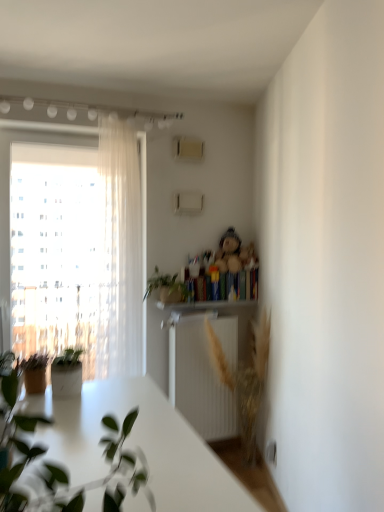
In order to face sheer white curtain at left, should I rotate leftwards or rightwards?

It's best to rotate left around 9.683 degrees.

Describe the element at coordinates (122, 247) in the screenshot. This screenshot has width=384, height=512. I see `sheer white curtain at left` at that location.

What do you see at coordinates (66, 470) in the screenshot? I see `green matte plant at left, marked as the 2th houseplant in a back-to-front arrangement` at bounding box center [66, 470].

How much space does green matte plant at left, positioned as the 1th houseplant in front-to-back order, occupy vertically?

The height of green matte plant at left, positioned as the 1th houseplant in front-to-back order, is 19.25 inches.

What do you see at coordinates (225, 285) in the screenshot? I see `hardcover book at center` at bounding box center [225, 285].

I want to click on green matte plant at center, which is counted as the first houseplant, starting from the back, so click(x=166, y=287).

This screenshot has height=512, width=384. Identify the location of window sill directly beneath the transparent glass window at left (from a real-world perspective). (206, 305).

Is transparent glass window at left oriented away from wooden shelf at upper center?

No, wooden shelf at upper center is not at the back of transparent glass window at left.

Which object is further away from the camera, transparent glass window at left or wooden shelf at upper center?

wooden shelf at upper center is more distant.

Considering the relative sizes of sheer white curtain at left and hardcover book at center in the image provided, is sheer white curtain at left taller than hardcover book at center?

Indeed, sheer white curtain at left has a greater height compared to hardcover book at center.

Considering their positions, is sheer white curtain at left located in front of or behind hardcover book at center?

sheer white curtain at left is positioned closer to the viewer than hardcover book at center.

Is hardcover book at center surrounded by sheer white curtain at left?

No, hardcover book at center is located outside of sheer white curtain at left.

From the image's perspective, which object appears higher, sheer white curtain at left or hardcover book at center?

From the image's view, sheer white curtain at left is above.

Considering the positions of point (5, 379) and point (204, 298), is point (5, 379) closer or farther from the camera than point (204, 298)?

Point (5, 379).

Looking at this image, is green matte plant at left, positioned as the 1th houseplant in front-to-back order, oriented towards hardcover book at center?

No, green matte plant at left, positioned as the 1th houseplant in front-to-back order, is not facing towards hardcover book at center.

Does green matte plant at left, marked as the 2th houseplant in a back-to-front arrangement, have a smaller size compared to hardcover book at center?

Incorrect, green matte plant at left, marked as the 2th houseplant in a back-to-front arrangement, is not smaller in size than hardcover book at center.

How distant is green matte plant at left, positioned as the 1th houseplant in front-to-back order, from hardcover book at center?

green matte plant at left, positioned as the 1th houseplant in front-to-back order, and hardcover book at center are 2.22 meters apart.

Is sheer white curtain at left beside wooden shelf at upper center?

They are not placed beside each other.

The image size is (384, 512). I want to click on window sill on the right of sheer white curtain at left, so click(206, 305).

Is sheer white curtain at left further to camera compared to wooden shelf at upper center?

No, sheer white curtain at left is closer to the viewer.

Who is taller, green matte plant at center, which is counted as the first houseplant, starting from the back, or transparent glass window at left?

Standing taller between the two is transparent glass window at left.

Are green matte plant at center, which is counted as the first houseplant, starting from the back, and transparent glass window at left located far from each other?

green matte plant at center, which is counted as the first houseplant, starting from the back, is positioned a significant distance from transparent glass window at left.

Considering the points (171, 291) and (118, 212), which point is in front, point (171, 291) or point (118, 212)?

The point (118, 212) is closer.

How many degrees apart are the facing directions of green matte plant at center, which is counted as the first houseplant, starting from the back, and transparent glass window at left?

3.46 degrees separate the facing orientations of green matte plant at center, which is counted as the first houseplant, starting from the back, and transparent glass window at left.

From a real-world perspective, is fluffy beige teddy bear at upper center under wooden shelf at upper center?

No, from a real-world perspective, fluffy beige teddy bear at upper center is not below wooden shelf at upper center.

Looking at this image, does fluffy beige teddy bear at upper center come behind wooden shelf at upper center?

Yes, fluffy beige teddy bear at upper center is further from the viewer.

Is fluffy beige teddy bear at upper center not near wooden shelf at upper center?

That's not correct — fluffy beige teddy bear at upper center is a little close to wooden shelf at upper center.

At what (x,y) coordinates should I click in order to perform the action: click on toy behind the wooden shelf at upper center. Please return your answer as a coordinate pair (x, y). Looking at the image, I should click on (234, 253).

From the image's perspective, between green matte plant at left, positioned as the 1th houseplant in front-to-back order, and green matte plant at center, the 2th houseplant positioned from the front, who is located below?

From the image's view, green matte plant at left, positioned as the 1th houseplant in front-to-back order, is below.

Does green matte plant at left, positioned as the 1th houseplant in front-to-back order, have a smaller size compared to green matte plant at center, the 2th houseplant positioned from the front?

No, green matte plant at left, positioned as the 1th houseplant in front-to-back order, is not smaller than green matte plant at center, the 2th houseplant positioned from the front.

What's the angular difference between green matte plant at left, positioned as the 1th houseplant in front-to-back order, and green matte plant at center, the 2th houseplant positioned from the front,'s facing directions?

89.3 degrees separate the facing orientations of green matte plant at left, positioned as the 1th houseplant in front-to-back order, and green matte plant at center, the 2th houseplant positioned from the front.

Is green matte plant at left, positioned as the 1th houseplant in front-to-back order, closer to the viewer compared to green matte plant at center, the 2th houseplant positioned from the front?

Yes, green matte plant at left, positioned as the 1th houseplant in front-to-back order, is in front of green matte plant at center, the 2th houseplant positioned from the front.

Find the location of a particular element. Image resolution: width=384 pixels, height=512 pixels. window that is above the wooden shelf at upper center (from a real-world perspective) is located at coordinates (79, 253).

At what (x,y) coordinates should I click in order to perform the action: click on book below the sheer white curtain at left (from a real-world perspective). Please return your answer as a coordinate pair (x, y). The width and height of the screenshot is (384, 512). Looking at the image, I should click on (225, 285).

From the image, which object appears to be farther from transparent glass window at left, sheer white curtain at left or green matte plant at center, the 2th houseplant positioned from the front?

Among the two, green matte plant at center, the 2th houseplant positioned from the front, is located further to transparent glass window at left.

When comparing their distances from green matte plant at center, the 2th houseplant positioned from the front, does sheer white curtain at left or wooden shelf at upper center seem further?

Among the two, sheer white curtain at left is located further to green matte plant at center, the 2th houseplant positioned from the front.

Based on their spatial positions, is wooden shelf at upper center or green matte plant at left, marked as the 2th houseplant in a back-to-front arrangement, further from fluffy beige teddy bear at upper center?

green matte plant at left, marked as the 2th houseplant in a back-to-front arrangement, is positioned further to the anchor fluffy beige teddy bear at upper center.

From the image, which object appears to be nearer to transparent glass window at left, sheer white curtain at left or wooden shelf at upper center?

sheer white curtain at left is closer to transparent glass window at left.

From the image, which object appears to be farther from green matte plant at left, positioned as the 1th houseplant in front-to-back order, hardcover book at center or transparent glass window at left?

The object further to green matte plant at left, positioned as the 1th houseplant in front-to-back order, is transparent glass window at left.

From the image, which object appears to be nearer to sheer white curtain at left, green matte plant at center, which is counted as the first houseplant, starting from the back, or hardcover book at center?

The object closer to sheer white curtain at left is green matte plant at center, which is counted as the first houseplant, starting from the back.

Looking at the image, which one is located closer to transparent glass window at left, wooden shelf at upper center or sheer white curtain at left?

sheer white curtain at left is positioned closer to the anchor transparent glass window at left.

When comparing their distances from wooden shelf at upper center, does hardcover book at center or green matte plant at left, positioned as the 1th houseplant in front-to-back order, seem closer?

Result: hardcover book at center.

Find the location of a particular element. The height and width of the screenshot is (512, 384). window between green matte plant at left, marked as the 2th houseplant in a back-to-front arrangement, and hardcover book at center in the front-back direction is located at coordinates (79, 253).

The height and width of the screenshot is (512, 384). I want to click on curtain between green matte plant at left, marked as the 2th houseplant in a back-to-front arrangement, and transparent glass window at left in the front-back direction, so click(122, 247).

At what (x,y) coordinates should I click in order to perform the action: click on curtain between transparent glass window at left and hardcover book at center in the horizontal direction. Please return your answer as a coordinate pair (x, y). The image size is (384, 512). Looking at the image, I should click on (122, 247).

I want to click on window sill between green matte plant at center, which is counted as the first houseplant, starting from the back, and fluffy beige teddy bear at upper center, so click(x=206, y=305).